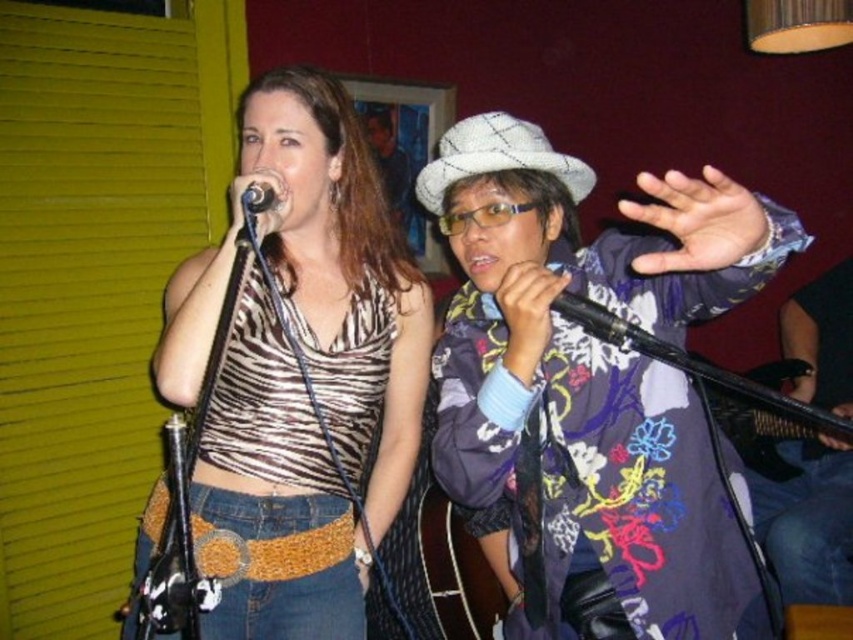
Question: Considering the real-world distances, which object is closest to the black matte microphone at upper center?

Choices:
 (A) dark blue jeans at lower right
 (B) floral fabric instrument at center
 (C) zebra print tank top at center
 (D) floral-patterned fabric at center

Answer: (C)

Question: Estimate the real-world distances between objects in this image. Which object is farther from the black matte microphone at upper center?

Choices:
 (A) dark blue jeans at lower right
 (B) floral fabric instrument at center
 (C) floral-patterned fabric at center

Answer: (A)

Question: Which object is the farthest from the dark blue jeans at lower right?

Choices:
 (A) zebra print tank top at center
 (B) black matte microphone at upper center

Answer: (B)

Question: Can you confirm if floral-patterned fabric at center is bigger than zebra print tank top at center?

Choices:
 (A) no
 (B) yes

Answer: (B)

Question: Does zebra print tank top at center have a larger size compared to black matte microphone at upper center?

Choices:
 (A) no
 (B) yes

Answer: (B)

Question: Is zebra print tank top at center smaller than dark blue jeans at lower right?

Choices:
 (A) yes
 (B) no

Answer: (A)